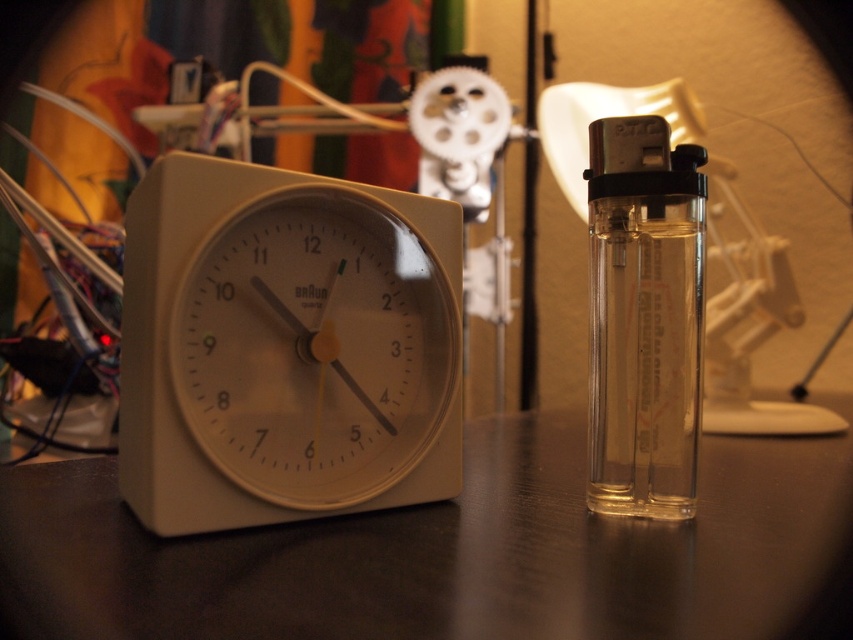
Question: Is black matte table at center below transparent plastic lighter at right?

Choices:
 (A) yes
 (B) no

Answer: (A)

Question: Which of these objects is positioned closest to the white plastic clock at left?

Choices:
 (A) transparent plastic lighter at right
 (B) black matte table at center

Answer: (B)

Question: Among these objects, which one is nearest to the camera?

Choices:
 (A) black matte table at center
 (B) transparent plastic lighter at right

Answer: (A)

Question: Is black matte table at center below transparent plastic lighter at right?

Choices:
 (A) no
 (B) yes

Answer: (B)

Question: Which of the following is the closest to the observer?

Choices:
 (A) (125, 621)
 (B) (647, 269)

Answer: (A)

Question: Observing the image, what is the correct spatial positioning of black matte table at center in reference to transparent plastic lighter at right?

Choices:
 (A) below
 (B) above

Answer: (A)